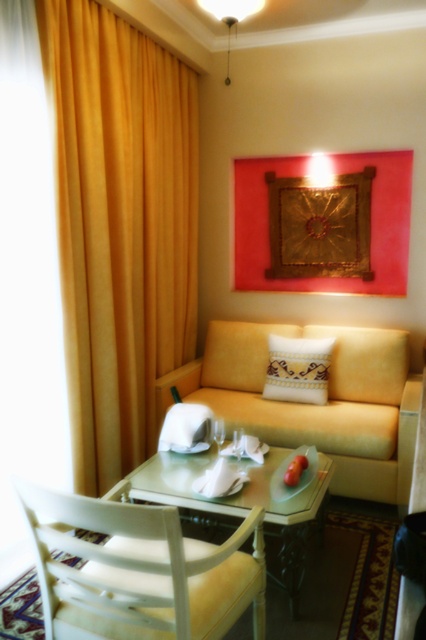
Is point (299, 216) positioned before point (184, 474)?

No, it is behind (184, 474).

Can you confirm if gold textured fabric at upper center is thinner than transparent glass table at center?

Indeed, gold textured fabric at upper center has a lesser width compared to transparent glass table at center.

This screenshot has width=426, height=640. In order to click on gold textured fabric at upper center in this screenshot , I will do `click(319, 227)`.

Is transparent glass table at center shorter than embroidered fabric pillow at center?

Yes.

Which is above, transparent glass table at center or embroidered fabric pillow at center?

embroidered fabric pillow at center is above.

What do you see at coordinates (232, 496) in the screenshot? I see `transparent glass table at center` at bounding box center [232, 496].

The height and width of the screenshot is (640, 426). I want to click on transparent glass table at center, so [232, 496].

From the picture: Does white wood chair at lower left have a smaller size compared to transparent glass table at center?

Actually, white wood chair at lower left might be larger than transparent glass table at center.

Does white wood chair at lower left have a lesser width compared to transparent glass table at center?

Indeed, white wood chair at lower left has a lesser width compared to transparent glass table at center.

The image size is (426, 640). Describe the element at coordinates (141, 572) in the screenshot. I see `white wood chair at lower left` at that location.

Identify the location of white wood chair at lower left. (141, 572).